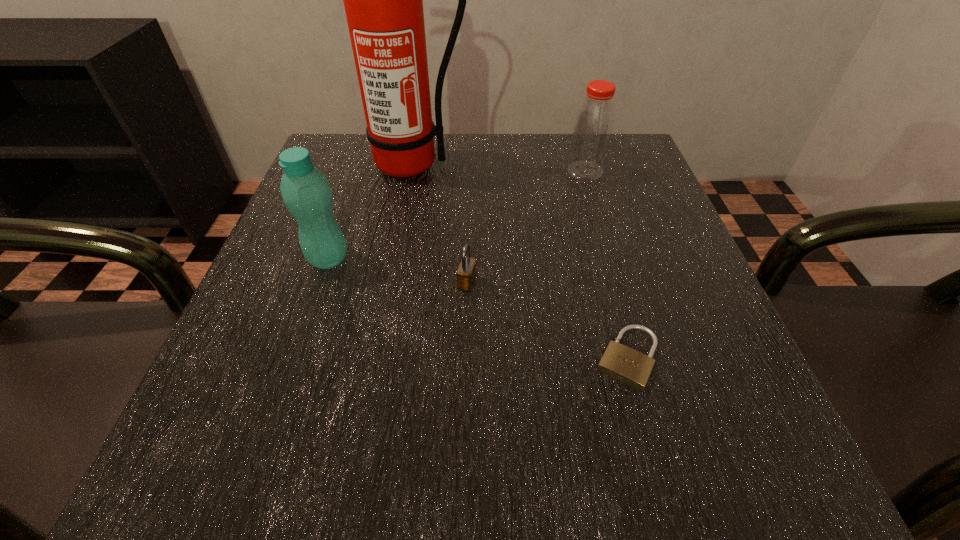
Identify the location of vacant area at the far edge. (454, 136).

In the image, there is a desktop. At what (x,y) coordinates should I click in order to perform the action: click on vacant area at the near edge. Please return your answer as a coordinate pair (x, y). Looking at the image, I should click on (416, 472).

Locate an element on the screen. This screenshot has height=540, width=960. vacant space at the left edge of the desktop is located at coordinates (214, 401).

The width and height of the screenshot is (960, 540). I want to click on vacant area at the right edge of the desktop, so [665, 237].

Find the location of a particular element. free space at the far left corner of the desktop is located at coordinates (319, 152).

Where is `free region at the near left corner of the desktop`? The width and height of the screenshot is (960, 540). free region at the near left corner of the desktop is located at coordinates (169, 487).

This screenshot has width=960, height=540. Find the location of `free space at the near right corner of the desktop`. free space at the near right corner of the desktop is located at coordinates (692, 489).

In order to click on vacant area between the right bottle and the left bottle in this screenshot , I will do `click(457, 215)`.

Identify the location of unoccupied position between the tallest object and the nearer padlock. This screenshot has height=540, width=960. (520, 261).

You are a GUI agent. You are given a task and a screenshot of the screen. Output one action in this format:
    pyautogui.click(x=<x>, y=<y>)
    Task: Click on the free space between the taller padlock and the right bottle
    The width and height of the screenshot is (960, 540).
    Given the screenshot: What is the action you would take?
    pyautogui.click(x=526, y=227)